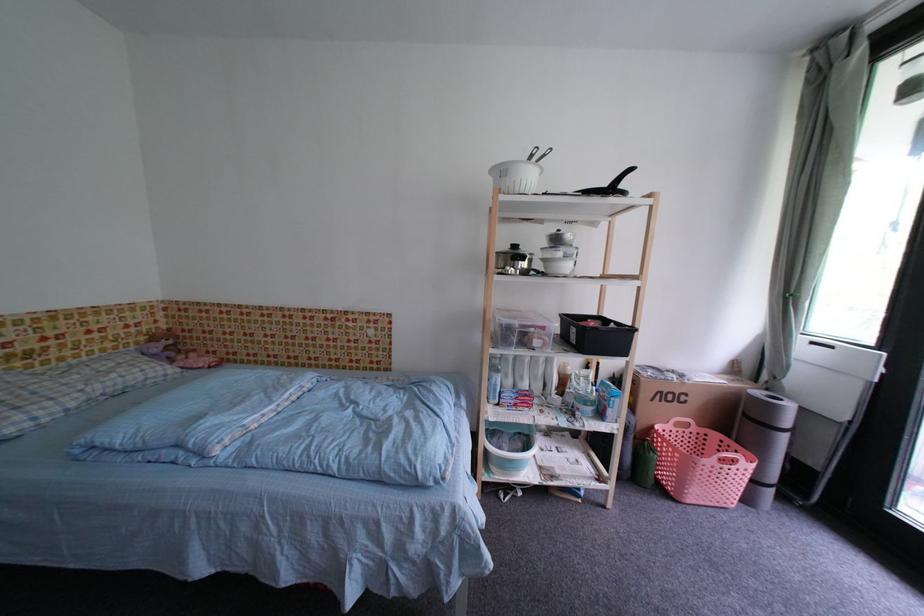
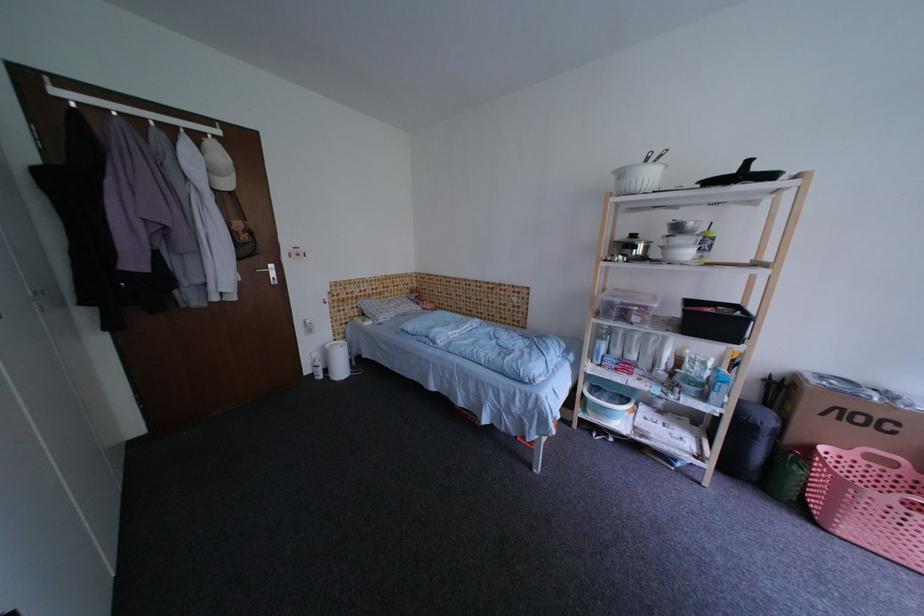
Question: The images are taken continuously from a first-person perspective. In which direction is your viewpoint rotating?

Choices:
 (A) Left
 (B) Right
 (C) Up
 (D) Down

Answer: (A)